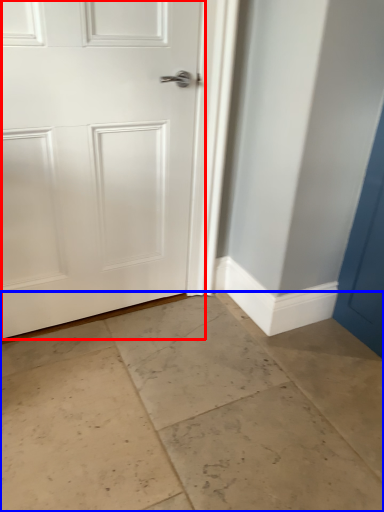
Question: Which object is further to the camera taking this photo, door (highlighted by a red box) or concrete (highlighted by a blue box)?

Choices:
 (A) door
 (B) concrete

Answer: (A)